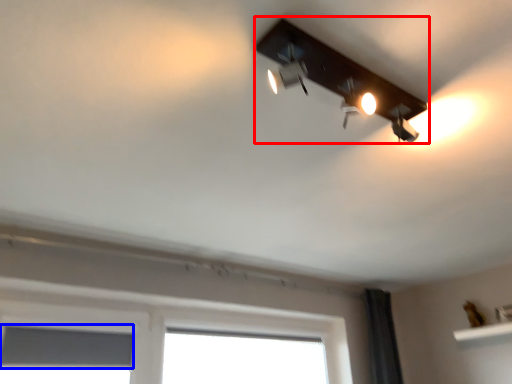
Question: Which of the following is the farthest to the observer, lamp (highlighted by a red box) or window screen (highlighted by a blue box)?

Choices:
 (A) lamp
 (B) window screen

Answer: (B)